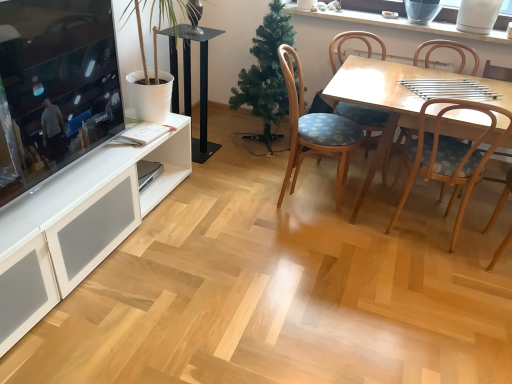
The image size is (512, 384). In order to click on vacant space in between black glass speaker at center and green matte christmas tree at center in this screenshot , I will do `click(228, 152)`.